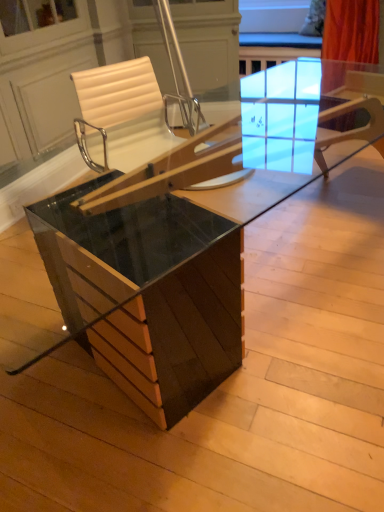
Describe the element at coordinates (123, 115) in the screenshot. I see `white leather chair at center` at that location.

At what (x,y) coordinates should I click in order to perform the action: click on white leather chair at center. Please return your answer as a coordinate pair (x, y). The image size is (384, 512). Looking at the image, I should click on (123, 115).

Identify the location of glossy wood table at center. The width and height of the screenshot is (384, 512). pos(160,281).

Describe the element at coordinates (160, 281) in the screenshot. I see `glossy wood table at center` at that location.

Locate an element on the screen. white leather chair at center is located at coordinates (123, 115).

Which is more to the left, white leather chair at center or glossy wood table at center?

Positioned to the left is white leather chair at center.

Does white leather chair at center lie in front of glossy wood table at center?

No, white leather chair at center is further to the viewer.

Is point (156, 140) in front of point (218, 234)?

No, (156, 140) is behind (218, 234).

From the image's perspective, is white leather chair at center located above or below glossy wood table at center?

From the image's perspective, white leather chair at center appears above glossy wood table at center.

From a real-world perspective, is white leather chair at center on glossy wood table at center?

Correct, in the physical world, white leather chair at center is higher than glossy wood table at center.

Based on the photo, in terms of width, does white leather chair at center look wider or thinner when compared to glossy wood table at center?

Clearly, white leather chair at center has less width compared to glossy wood table at center.

Can you confirm if white leather chair at center is shorter than glossy wood table at center?

No.

Can you confirm if white leather chair at center is bigger than glossy wood table at center?

Actually, white leather chair at center might be smaller than glossy wood table at center.

Would you say glossy wood table at center is part of white leather chair at center's contents?

Definitely not — glossy wood table at center is not inside white leather chair at center.

Are white leather chair at center and glossy wood table at center far apart?

No, there isn't a large distance between white leather chair at center and glossy wood table at center.

Is white leather chair at center oriented towards glossy wood table at center?

Yes, white leather chair at center faces towards glossy wood table at center.

How many degrees apart are the facing directions of white leather chair at center and glossy wood table at center?

The angle between the facing direction of white leather chair at center and the facing direction of glossy wood table at center is 172 degrees.

How distant is white leather chair at center from glossy wood table at center?

white leather chair at center is 37.55 inches from glossy wood table at center.

The width and height of the screenshot is (384, 512). In the image, there is a glossy wood table at center. What are the coordinates of `chair above it (from the image's perspective)` in the screenshot? It's located at (x=123, y=115).

Which object is positioned more to the right, glossy wood table at center or white leather chair at center?

glossy wood table at center is more to the right.

Considering the positions of objects glossy wood table at center and white leather chair at center in the image provided, who is behind, glossy wood table at center or white leather chair at center?

white leather chair at center is further from the camera.

Does point (117, 237) come farther from viewer compared to point (134, 106)?

No, (117, 237) is in front of (134, 106).

From the image's perspective, does glossy wood table at center appear higher than white leather chair at center?

No, from the image's perspective, glossy wood table at center is not over white leather chair at center.

From a real-world perspective, is glossy wood table at center below white leather chair at center?

Yes, from a real-world perspective, glossy wood table at center is below white leather chair at center.

In terms of width, does glossy wood table at center look wider or thinner when compared to white leather chair at center?

In the image, glossy wood table at center appears to be wider than white leather chair at center.

Considering the sizes of glossy wood table at center and white leather chair at center in the image, is glossy wood table at center taller or shorter than white leather chair at center?

In the image, glossy wood table at center appears to be shorter than white leather chair at center.

Does glossy wood table at center have a larger size compared to white leather chair at center?

Yes, glossy wood table at center is bigger than white leather chair at center.

Could white leather chair at center be considered to be inside glossy wood table at center?

No, glossy wood table at center does not contain white leather chair at center.

Is glossy wood table at center next to white leather chair at center?

glossy wood table at center is not next to white leather chair at center, and they're not touching.

Based on the photo, is glossy wood table at center oriented away from white leather chair at center?

Yes, glossy wood table at center's orientation is away from white leather chair at center.

How many degrees apart are the facing directions of glossy wood table at center and white leather chair at center?

There is a 172-degree angle between the facing directions of glossy wood table at center and white leather chair at center.

Find the location of a particular element. The image size is (384, 512). table below the white leather chair at center (from the image's perspective) is located at coordinates (160, 281).

Identify the location of table below the white leather chair at center (from a real-world perspective). The width and height of the screenshot is (384, 512). (160, 281).

Where is `table that is in front of the white leather chair at center`? The image size is (384, 512). table that is in front of the white leather chair at center is located at coordinates tap(160, 281).